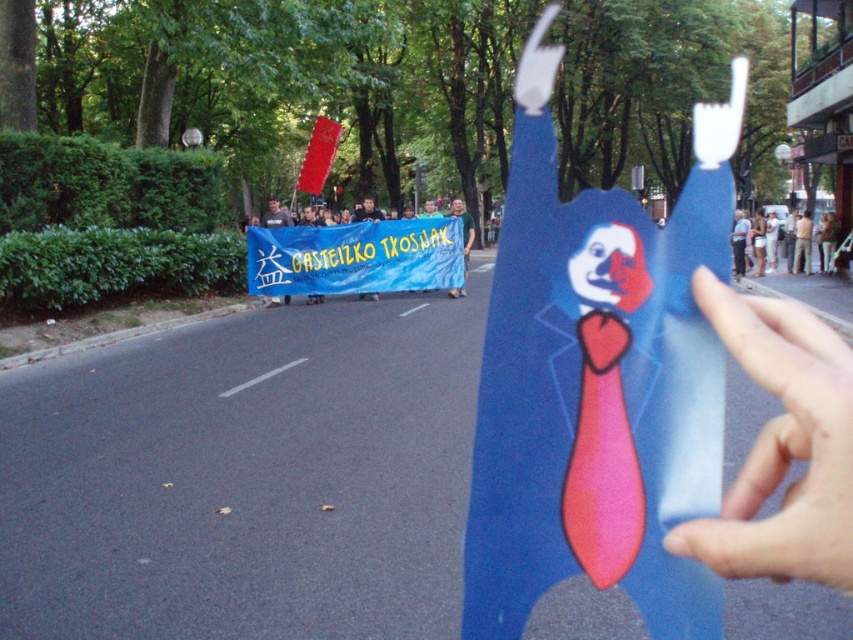
Question: Can you confirm if blue fabric banner at center is positioned below white plastic fork at upper right?

Choices:
 (A) yes
 (B) no

Answer: (A)

Question: Among these objects, which one is farthest from the camera?

Choices:
 (A) blue fabric banner at center
 (B) light blue paper cutout at right
 (C) smooth blue paper at center
 (D) white plastic fork at upper right

Answer: (D)

Question: Estimate the real-world distances between objects in this image. Which object is farther from the blue paper cutout at center?

Choices:
 (A) white plastic fork at upper right
 (B) light blue paper cutout at right

Answer: (A)

Question: Among these points, which one is nearest to the camera?

Choices:
 (A) [724, 124]
 (B) [624, 472]
 (C) [370, 241]

Answer: (B)

Question: Is pink fabric tie at center above light blue paper cutout at right?

Choices:
 (A) yes
 (B) no

Answer: (B)

Question: Is blue fabric banner at center to the left of light blue paper cutout at right from the viewer's perspective?

Choices:
 (A) no
 (B) yes

Answer: (B)